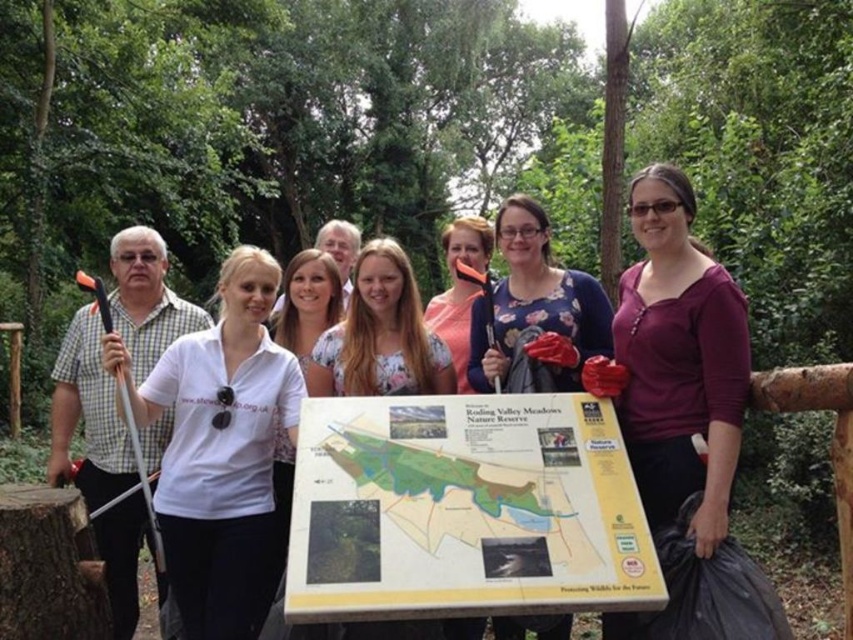
Is point (485, 308) positioned behind point (556, 296)?

Yes, it is.

Where is `matte blue shirt at center`? The image size is (853, 640). matte blue shirt at center is located at coordinates (534, 312).

Is yellow matte board at center below matte blue shirt at center?

Yes.

This screenshot has height=640, width=853. What do you see at coordinates (463, 509) in the screenshot?
I see `yellow matte board at center` at bounding box center [463, 509].

Where is `yellow matte board at center`? Image resolution: width=853 pixels, height=640 pixels. yellow matte board at center is located at coordinates (463, 509).

I want to click on matte black axe at left, so click(86, 416).

Is point (131, 522) positioned after point (434, 364)?

Yes, point (131, 522) is behind point (434, 364).

Locate an element on the screen. This screenshot has width=853, height=640. matte black axe at left is located at coordinates (86, 416).